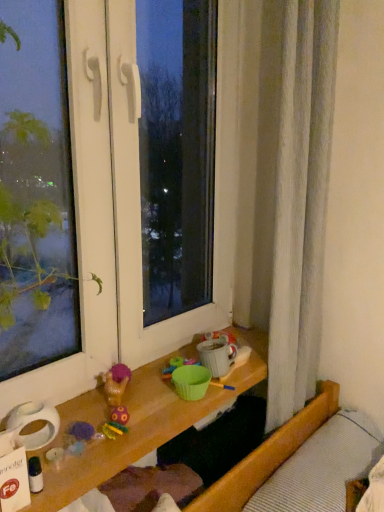
Question: Considering the relative positions of plush purple toy at lower left, positioned as the second toy in left-to-right order, and white textured bed at lower right in the image provided, is plush purple toy at lower left, positioned as the second toy in left-to-right order, to the right of white textured bed at lower right from the viewer's perspective?

Choices:
 (A) yes
 (B) no

Answer: (B)

Question: From the image's perspective, is plush purple toy at lower left, which is counted as the second toy, starting from the bottom, below white textured bed at lower right?

Choices:
 (A) no
 (B) yes

Answer: (A)

Question: Is white textured bed at lower right located within plush purple toy at lower left, the 1th toy in the right-to-left sequence?

Choices:
 (A) yes
 (B) no

Answer: (B)

Question: Is plush purple toy at lower left, positioned as the second toy in front-to-back order, closer to camera compared to white textured bed at lower right?

Choices:
 (A) yes
 (B) no

Answer: (B)

Question: Is plush purple toy at lower left, positioned as the second toy in left-to-right order, taller than white textured bed at lower right?

Choices:
 (A) no
 (B) yes

Answer: (A)

Question: From the image's perspective, would you say plush purple toy at lower left, the 1th toy in the right-to-left sequence, is positioned over white textured bed at lower right?

Choices:
 (A) yes
 (B) no

Answer: (A)

Question: Is transparent glass window at center thinner than translucent plastic bottle at lower left, the first toy when ordered from bottom to top?

Choices:
 (A) yes
 (B) no

Answer: (B)

Question: Can you confirm if transparent glass window at center is taller than translucent plastic bottle at lower left, placed as the 1th toy when sorted from front to back?

Choices:
 (A) no
 (B) yes

Answer: (B)

Question: Is transparent glass window at center beside translucent plastic bottle at lower left, the first toy when ordered from bottom to top?

Choices:
 (A) no
 (B) yes

Answer: (A)

Question: Could you tell me if transparent glass window at center is turned towards translucent plastic bottle at lower left, positioned as the 2th toy in top-to-bottom order?

Choices:
 (A) yes
 (B) no

Answer: (B)

Question: From the image's perspective, does transparent glass window at center appear lower than translucent plastic bottle at lower left, placed as the 1th toy when sorted from front to back?

Choices:
 (A) yes
 (B) no

Answer: (B)

Question: Would you say transparent glass window at center contains translucent plastic bottle at lower left, positioned as the 2th toy in top-to-bottom order?

Choices:
 (A) yes
 (B) no

Answer: (A)

Question: Is translucent plastic bottle at lower left, marked as the 1th toy in a left-to-right arrangement, beside white textured bed at lower right?

Choices:
 (A) no
 (B) yes

Answer: (A)